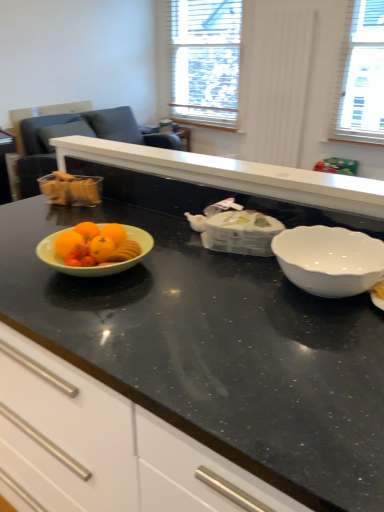
What do you see at coordinates (44, 146) in the screenshot? I see `matte gray armchair at left` at bounding box center [44, 146].

Measure the distance between point [238,105] and camera.

The depth of point [238,105] is 4.65 meters.

Describe the element at coordinates (71, 189) in the screenshot. I see `translucent plastic container at left` at that location.

You are a GUI agent. You are given a task and a screenshot of the screen. Output one action in this format:
    pyautogui.click(x=<x>, y=<y>)
    Task: Click on the black granite countertop at center
    
    Given the screenshot: What is the action you would take?
    [215, 350]

The height and width of the screenshot is (512, 384). In order to click on matte gray armchair at left in this screenshot , I will do [x=44, y=146].

Where is `tableware that is under the white glossy bowl at right (from a real-world perspective)`? tableware that is under the white glossy bowl at right (from a real-world perspective) is located at coordinates (71, 189).

From a real-world perspective, between white glossy bowl at right and translucent plastic container at left, who is vertically lower?

From a 3D spatial view, translucent plastic container at left is below.

Is white glossy bowl at right smaller than translucent plastic container at left?

No, white glossy bowl at right is not smaller than translucent plastic container at left.

Is white glossy bowl at right touching translucent plastic container at left?

No.

Identify the location of armchair that is below the white wood blinds at upper center (from the image's perspective). The image size is (384, 512). (44, 146).

Which of these two, white wood blinds at upper center or matte gray armchair at left, stands shorter?

With less height is matte gray armchair at left.

Considering the positions of objects white wood blinds at upper center and matte gray armchair at left in the image provided, who is behind, white wood blinds at upper center or matte gray armchair at left?

white wood blinds at upper center.

Can you confirm if translucent plastic container at left is thinner than white wood blinds at upper center?

Yes, translucent plastic container at left is thinner than white wood blinds at upper center.

Are translucent plastic container at left and white wood blinds at upper center beside each other?

No, translucent plastic container at left is not next to white wood blinds at upper center.

Does point (74, 189) come farther from viewer compared to point (161, 16)?

No, it is not.

Looking at the image, does black granite countertop at center seem bigger or smaller compared to white wood blinds at upper center?

Clearly, black granite countertop at center is larger in size than white wood blinds at upper center.

Is white wood blinds at upper center at the back of black granite countertop at center?

black granite countertop at center is not turned away from white wood blinds at upper center.

Is white wood blinds at upper center surrounded by black granite countertop at center?

No.

Between white wood blinds at upper center and white glossy bowl at right, which one appears on the left side from the viewer's perspective?

Positioned to the left is white wood blinds at upper center.

Which is more distant, (243, 104) or (337, 253)?

The point (243, 104) is farther from the camera.

Where is `window to the left of white glossy bowl at right`? This screenshot has width=384, height=512. window to the left of white glossy bowl at right is located at coordinates (201, 61).

Is white wood blinds at upper center situated inside white glossy bowl at right or outside?

white wood blinds at upper center exists outside the volume of white glossy bowl at right.

Is black granite countertop at center smaller than white glossy bowl at right?

No.

In the scene shown: Considering the sizes of objects black granite countertop at center and white glossy bowl at right in the image provided, who is shorter, black granite countertop at center or white glossy bowl at right?

white glossy bowl at right is shorter.

In the scene shown: Between black granite countertop at center and white glossy bowl at right, which one appears on the right side from the viewer's perspective?

white glossy bowl at right is more to the right.

Is black granite countertop at center completely or partially outside of white glossy bowl at right?

Indeed, black granite countertop at center is completely outside white glossy bowl at right.

From the image's perspective, is white glossy bowl at right beneath matte gray armchair at left?

Yes, from the image's perspective, white glossy bowl at right is beneath matte gray armchair at left.

How many degrees apart are the facing directions of white glossy bowl at right and matte gray armchair at left?

The angle between the facing direction of white glossy bowl at right and the facing direction of matte gray armchair at left is 91.9 degrees.

In the image, is white glossy bowl at right positioned in front of or behind matte gray armchair at left?

white glossy bowl at right is in front of matte gray armchair at left.

This screenshot has height=512, width=384. What are the coordinates of `bowl lying below the translucent plastic container at left (from the image's perspective)` in the screenshot? It's located at (329, 260).

This screenshot has height=512, width=384. I want to click on window on the right of matte gray armchair at left, so click(x=201, y=61).

From the image, which object appears to be nearer to white wood blinds at upper center, matte gray armchair at left or white glossy bowl at right?

matte gray armchair at left is positioned closer to the anchor white wood blinds at upper center.

Looking at the image, which one is located further to black granite countertop at center, white wood blinds at upper center or white glossy bowl at right?

Among the two, white wood blinds at upper center is located further to black granite countertop at center.

From the image, which object appears to be nearer to white wood blinds at upper center, white glossy bowl at right or black granite countertop at center?

Based on the image, white glossy bowl at right appears to be nearer to white wood blinds at upper center.

Based on their spatial positions, is black granite countertop at center or matte gray armchair at left closer to translucent plastic container at left?

Based on the image, black granite countertop at center appears to be nearer to translucent plastic container at left.

Estimate the real-world distances between objects in this image. Which object is closer to black granite countertop at center, matte gray armchair at left or white wood blinds at upper center?

matte gray armchair at left is positioned closer to the anchor black granite countertop at center.

Looking at the image, which one is located further to white wood blinds at upper center, matte gray armchair at left or translucent plastic container at left?

translucent plastic container at left lies further to white wood blinds at upper center than the other object.

Looking at the image, which one is located further to black granite countertop at center, translucent plastic container at left or white glossy bowl at right?

translucent plastic container at left lies further to black granite countertop at center than the other object.

Which object lies nearer to the anchor point white glossy bowl at right, white wood blinds at upper center or translucent plastic container at left?

Based on the image, translucent plastic container at left appears to be nearer to white glossy bowl at right.

At what (x,y) coordinates should I click in order to perform the action: click on bowl between black granite countertop at center and matte gray armchair at left in the front-back direction. Please return your answer as a coordinate pair (x, y). This screenshot has height=512, width=384. Looking at the image, I should click on (329, 260).

This screenshot has width=384, height=512. Find the location of `armchair positioned between black granite countertop at center and white wood blinds at upper center from near to far`. armchair positioned between black granite countertop at center and white wood blinds at upper center from near to far is located at coordinates (44, 146).

This screenshot has height=512, width=384. Identify the location of bowl between black granite countertop at center and translucent plastic container at left from front to back. (329, 260).

Locate an element on the screen. This screenshot has width=384, height=512. armchair located between white glossy bowl at right and white wood blinds at upper center in the depth direction is located at coordinates (44, 146).